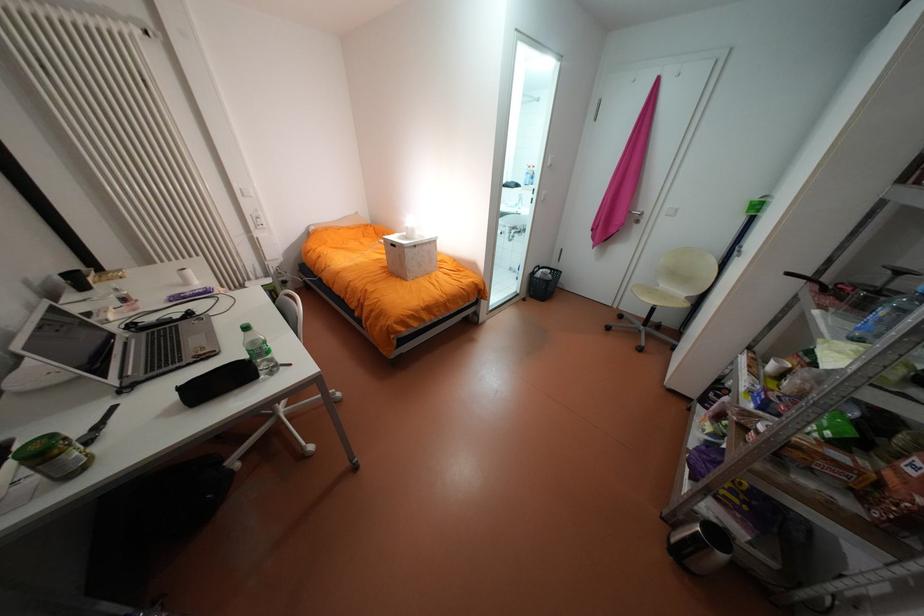
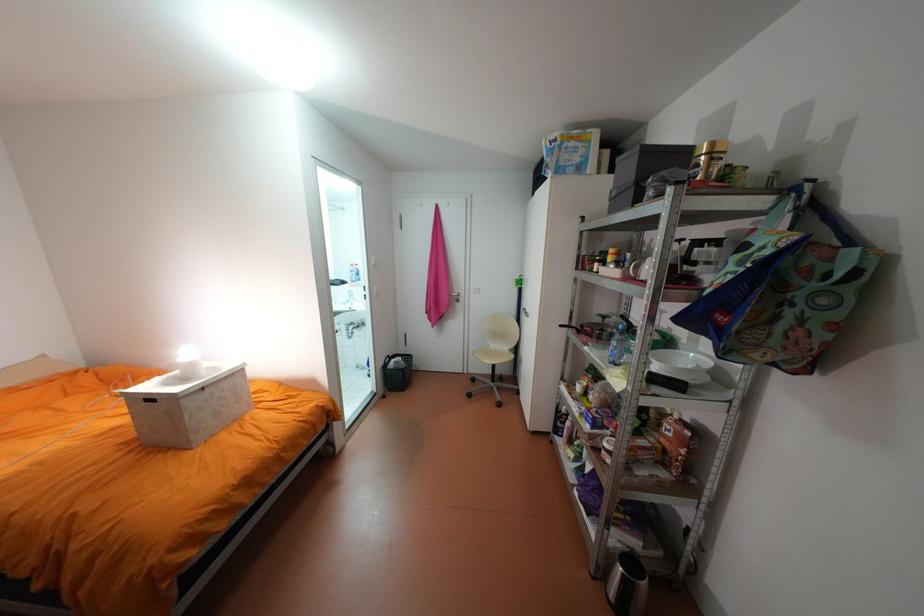
Find the pixel in the second image that matches pixel 416 237 in the first image.

(189, 379)